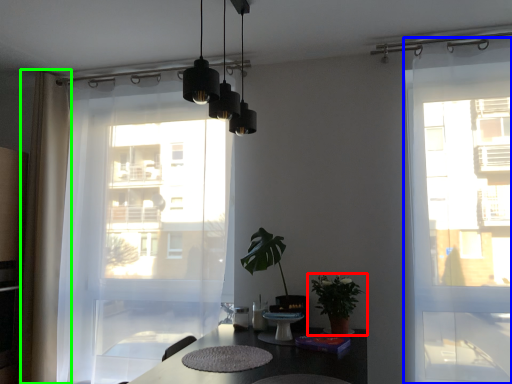
Question: Considering the real-world distances, which object is farthest from houseplant (highlighted by a red box)? door (highlighted by a blue box) or curtain (highlighted by a green box)?

Choices:
 (A) door
 (B) curtain

Answer: (B)